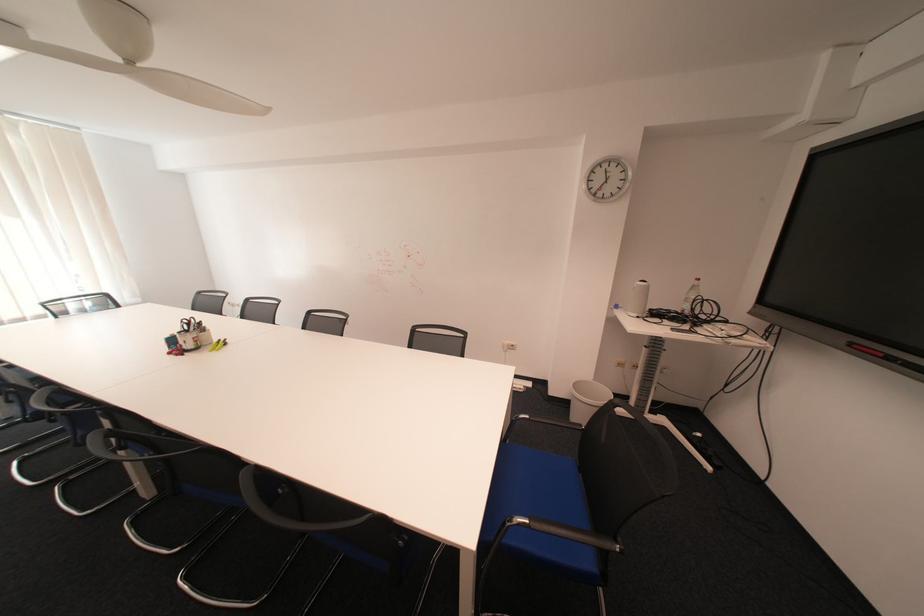
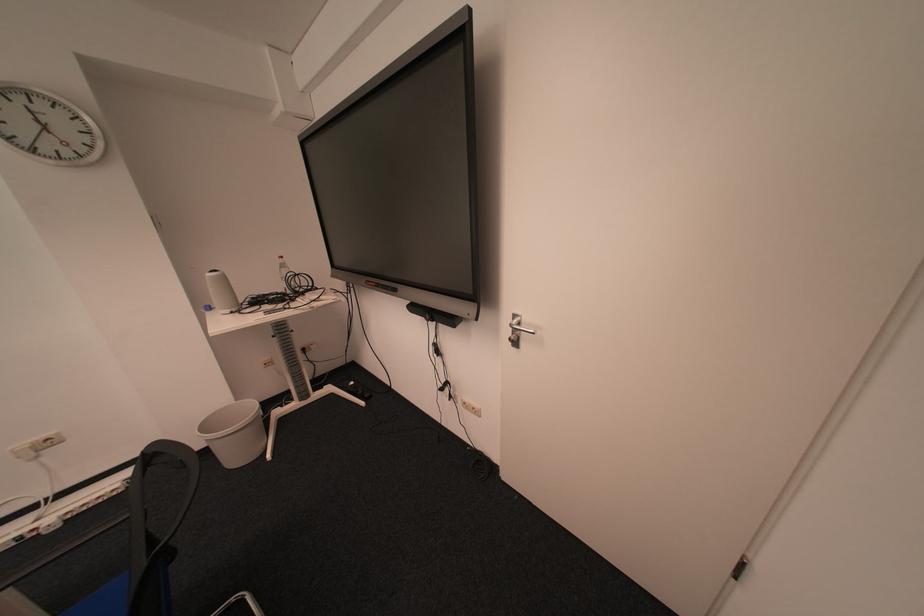
Locate, in the second image, the point that corresponds to the point at 627,307 in the first image.

(221, 309)